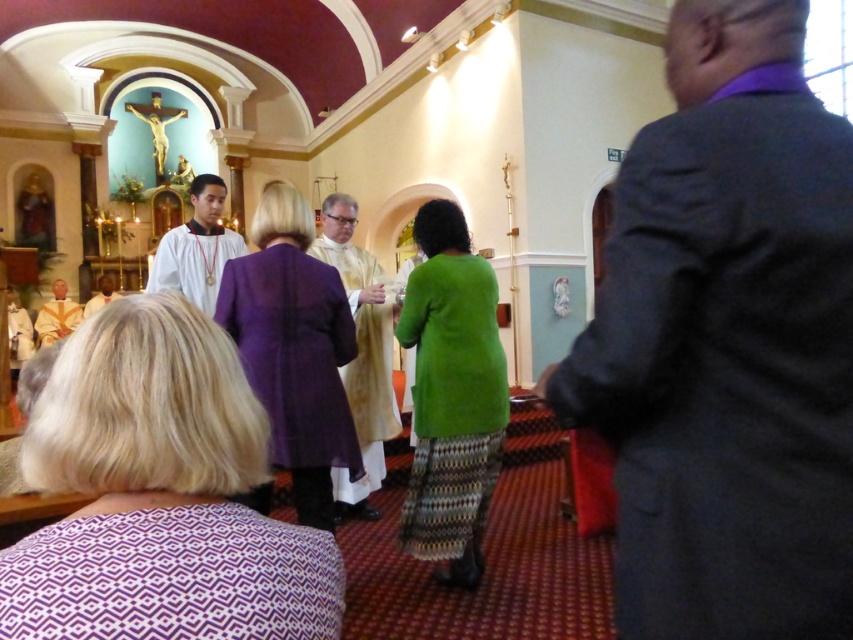
Image resolution: width=853 pixels, height=640 pixels. I want to click on green textured sweater at center, so click(451, 396).

Does green textured sweater at center appear over purple sheer dress at center?

No, green textured sweater at center is not above purple sheer dress at center.

The image size is (853, 640). What are the coordinates of `green textured sweater at center` in the screenshot? It's located at 451,396.

Locate an element on the screen. The height and width of the screenshot is (640, 853). green textured sweater at center is located at coordinates (451, 396).

Based on the photo, is green textured sweater at center behind white satin robe at center?

No.

Who is more forward, [473,298] or [119,292]?

Positioned in front is point [473,298].

Where is `green textured sweater at center`? This screenshot has width=853, height=640. green textured sweater at center is located at coordinates (451, 396).

Is point (50, 429) in front of point (368, 486)?

That is True.

Based on the photo, does purple fabric at lower center appear on the left side of gold textured robe at center?

Incorrect, purple fabric at lower center is not on the left side of gold textured robe at center.

Who is more forward, (0, 570) or (390, 374)?

Positioned in front is point (0, 570).

The height and width of the screenshot is (640, 853). What are the coordinates of `purple fabric at lower center` in the screenshot? It's located at (160, 493).